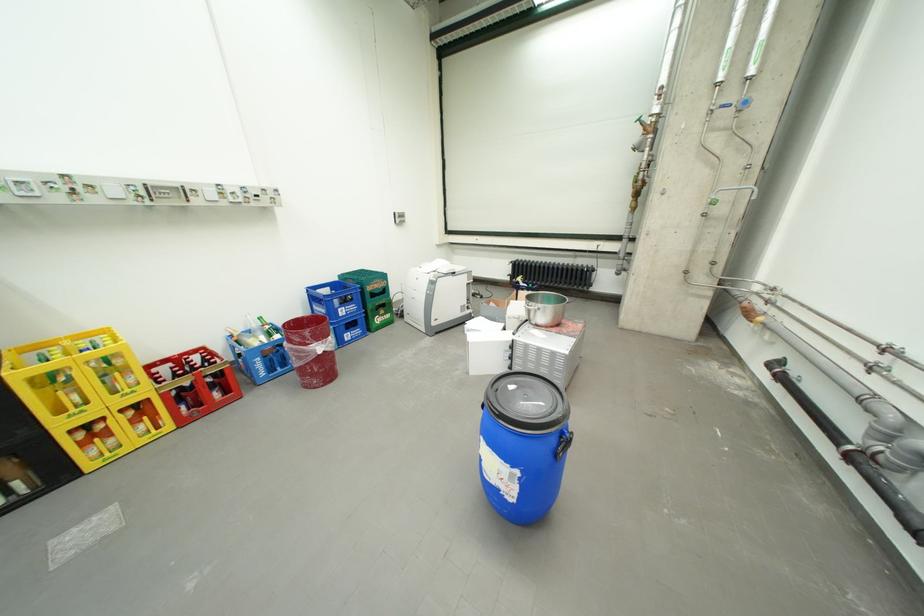
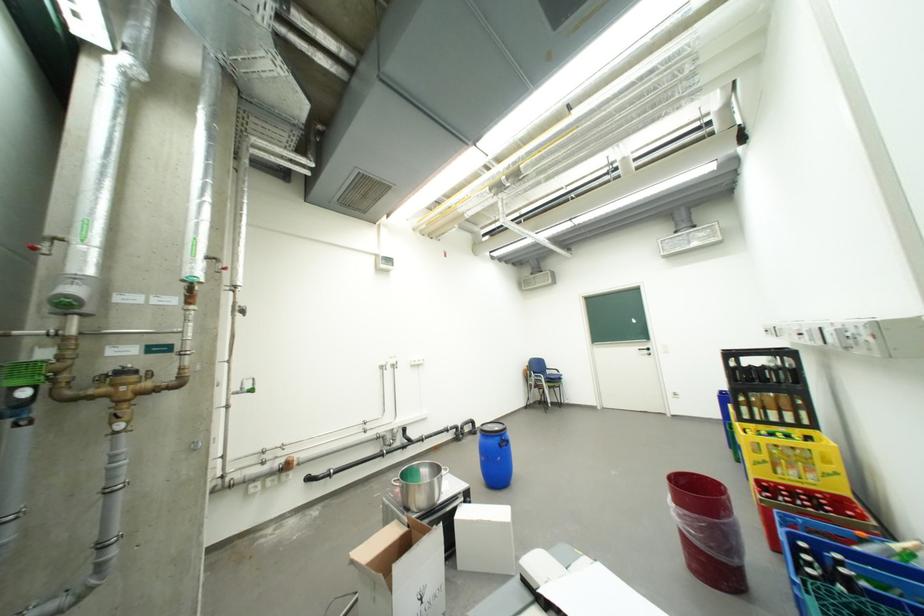
The point at (339, 339) is marked in the first image. Where is the corresponding point in the second image?

(685, 507)